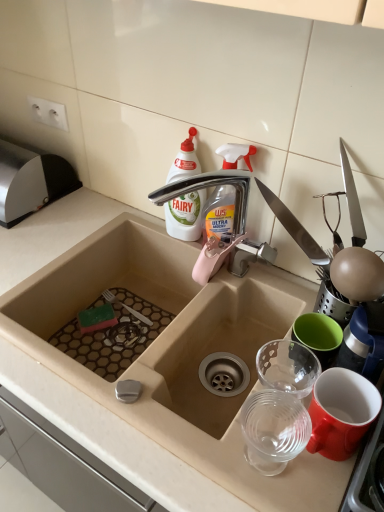
Where is `free space to the left of white plastic bottle at upper center`? This screenshot has height=512, width=384. free space to the left of white plastic bottle at upper center is located at coordinates (128, 225).